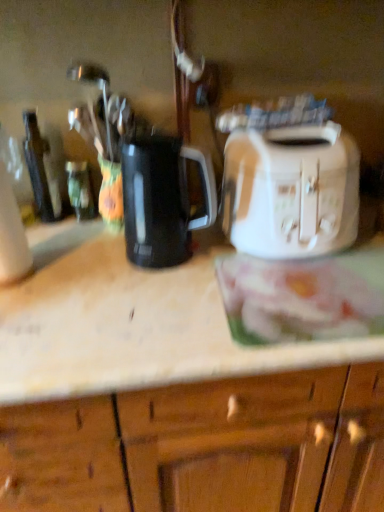
You are a GUI agent. You are given a task and a screenshot of the screen. Output one action in this format:
    pyautogui.click(x=<x>, y=<y>)
    Task: Click on the vacant space in front of dark brown glass bottle at left, which appears as the second bottle when viewed from the right
    The height and width of the screenshot is (512, 384).
    Given the screenshot: What is the action you would take?
    pyautogui.click(x=55, y=245)